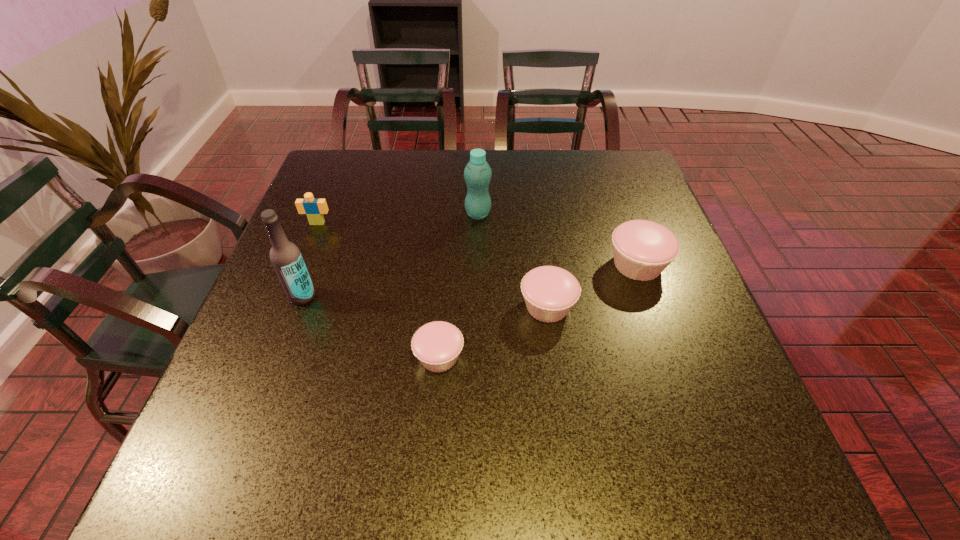
What are the coordinates of `the nearest object` in the screenshot? It's located at (437, 345).

This screenshot has height=540, width=960. I want to click on the leftmost cupcake, so click(437, 345).

Where is `the second shortest cupcake`? The width and height of the screenshot is (960, 540). the second shortest cupcake is located at coordinates (550, 292).

You are a GUI agent. You are given a task and a screenshot of the screen. Output one action in this format:
    pyautogui.click(x=<x>, y=<y>)
    Task: Click on the fifth tallest object
    The width and height of the screenshot is (960, 540).
    Given the screenshot: What is the action you would take?
    pyautogui.click(x=550, y=292)

Locate an element on the screen. The width and height of the screenshot is (960, 540). the rightmost object is located at coordinates (642, 249).

I want to click on the rightmost cupcake, so click(642, 249).

Find the location of a particular element. Lego is located at coordinates (314, 209).

Identify the location of the tallest object. The image size is (960, 540). (285, 256).

Where is `water bottle`? water bottle is located at coordinates (477, 174).

At what (x,y) coordinates should I click in order to perform the action: click on free location located 0.180m on the left of the nearest cupcake. Please return your answer as a coordinate pair (x, y). The image size is (960, 540). Looking at the image, I should click on (323, 357).